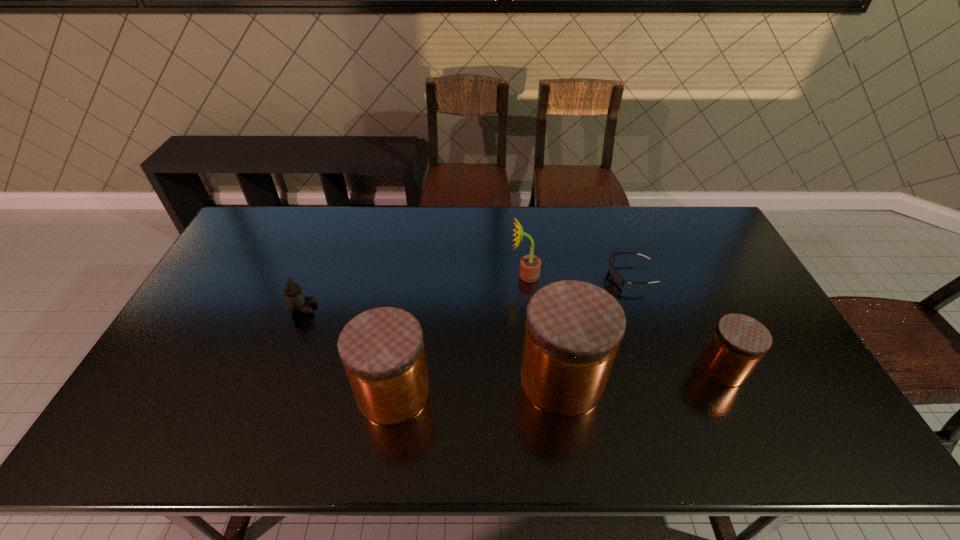
The width and height of the screenshot is (960, 540). Identify the location of the second shortest jar. (382, 349).

Where is `the leftmost jar`? Image resolution: width=960 pixels, height=540 pixels. the leftmost jar is located at coordinates (382, 349).

This screenshot has width=960, height=540. Identify the location of the second jar from left to right. (573, 330).

I want to click on the shortest jar, so click(738, 342).

Identify the location of the third shortest object. This screenshot has height=540, width=960. [x=738, y=342].

You are a GUI agent. You are given a task and a screenshot of the screen. Output one action in this format:
    pyautogui.click(x=<x>, y=<y>)
    Task: Click on the leftmost object
    This screenshot has width=960, height=540.
    Given the screenshot: What is the action you would take?
    pyautogui.click(x=295, y=300)

Locate an element on the screen. the third farthest object is located at coordinates (295, 300).

Locate an element on the screen. The height and width of the screenshot is (540, 960). sunflower is located at coordinates (530, 265).

Locate an element on the screen. The height and width of the screenshot is (540, 960). goggles is located at coordinates (615, 277).

This screenshot has width=960, height=540. What are the coordinates of `the fifth object from left to right` in the screenshot? It's located at (615, 277).